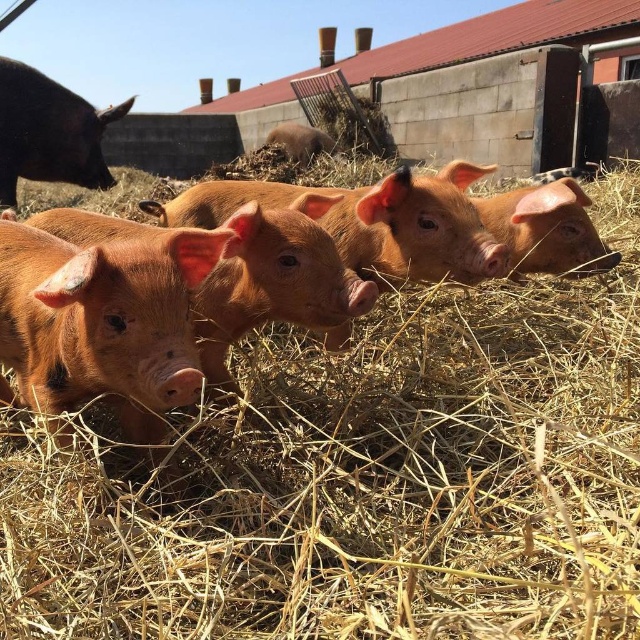
Between shiny black pig at upper left and smooth brown piglet at center, which one appears on the right side from the viewer's perspective?

smooth brown piglet at center

Is shiny black pig at upper left thinner than smooth brown piglet at center?

No.

Between point (20, 90) and point (509, 212), which one is positioned behind?

Positioned behind is point (20, 90).

Where is `shiny black pig at upper left`? The width and height of the screenshot is (640, 640). shiny black pig at upper left is located at coordinates (49, 132).

Can you confirm if shiny black pig at upper left is taller than brown matte piglet at center?

Correct, shiny black pig at upper left is much taller as brown matte piglet at center.

Is point (77, 179) more distant than point (282, 145)?

No, it is not.

Identify the location of shiny black pig at upper left. (49, 132).

Who is higher up, smooth brown piglet at center or brown matte piglet at center?

Positioned higher is brown matte piglet at center.

Between point (513, 244) and point (291, 161), which one is positioned in front?

Point (513, 244)

Locate an element on the screen. The image size is (640, 640). smooth brown piglet at center is located at coordinates (547, 228).